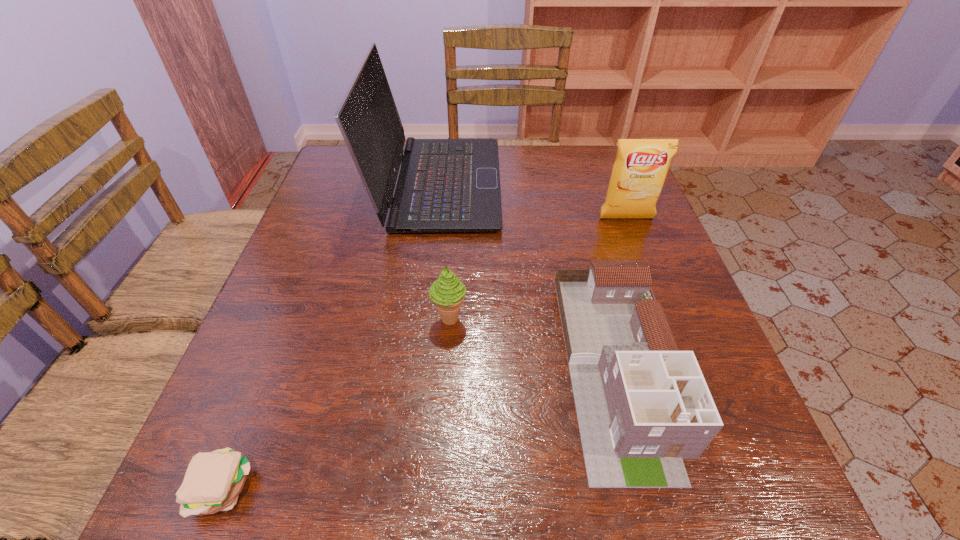
You are a GUI agent. You are given a task and a screenshot of the screen. Output one action in this format:
    pyautogui.click(x=<x>, y=<y>)
    Task: Click on the blank space at the far edge of the desktop
    Image resolution: width=960 pixels, height=540 pixels.
    Given the screenshot: What is the action you would take?
    pyautogui.click(x=502, y=151)

Image resolution: width=960 pixels, height=540 pixels. In the image, there is a desktop. Find the location of `blank space at the near edge`. blank space at the near edge is located at coordinates (450, 476).

The height and width of the screenshot is (540, 960). In the image, there is a desktop. Find the location of `vacant space at the left edge`. vacant space at the left edge is located at coordinates (280, 391).

Identify the location of vacant space at the right edge of the desktop. This screenshot has height=540, width=960. (716, 381).

Identify the location of free location at the near right corner of the desktop. This screenshot has width=960, height=540. (678, 500).

Identify the location of vacant area that lies between the laptop computer and the fourth shortest object. (532, 201).

This screenshot has width=960, height=540. What are the coordinates of `vacant area that lies between the icecream and the leftmost object` in the screenshot? It's located at (336, 403).

At what (x,y) coordinates should I click in order to perform the action: click on vacant space in between the icecream and the crisp (potato chip). Please return your answer as a coordinate pair (x, y). The image size is (960, 540). Looking at the image, I should click on (538, 268).

Identify the location of vacant region between the dollhouse and the shortest object. Image resolution: width=960 pixels, height=540 pixels. (420, 427).

This screenshot has height=540, width=960. In order to click on vacant region between the icecream and the shortest object in this screenshot , I will do coord(336,403).